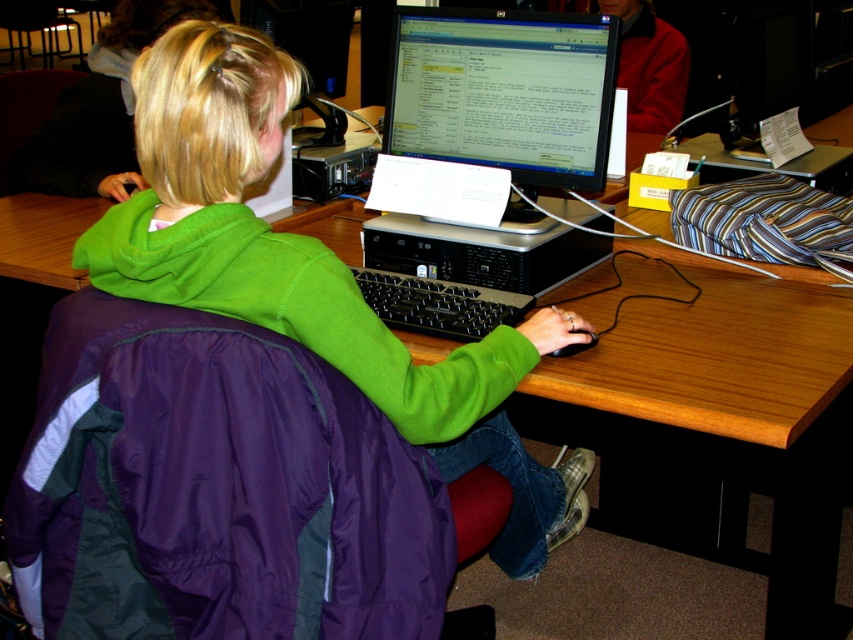
Question: Can you confirm if green fleece sweatshirt at center is thinner than black matte mouse at lower center?

Choices:
 (A) yes
 (B) no

Answer: (B)

Question: Which object is closer to the camera taking this photo?

Choices:
 (A) black matte mouse at lower center
 (B) black plastic computer at center
 (C) green fleece sweatshirt at center

Answer: (C)

Question: Does green fleece sweatshirt at center have a smaller size compared to red jacket at upper right?

Choices:
 (A) yes
 (B) no

Answer: (B)

Question: Among these points, which one is nearest to the camera?

Choices:
 (A) (96, 481)
 (B) (639, 45)
 (C) (427, 17)
 (D) (587, 333)

Answer: (A)

Question: Is matte black monitor at center wider than red jacket at upper right?

Choices:
 (A) yes
 (B) no

Answer: (A)

Question: Which point is farther to the camera?

Choices:
 (A) pos(140,196)
 (B) pos(651,32)
 (C) pos(561,353)
 (D) pos(485,125)

Answer: (B)